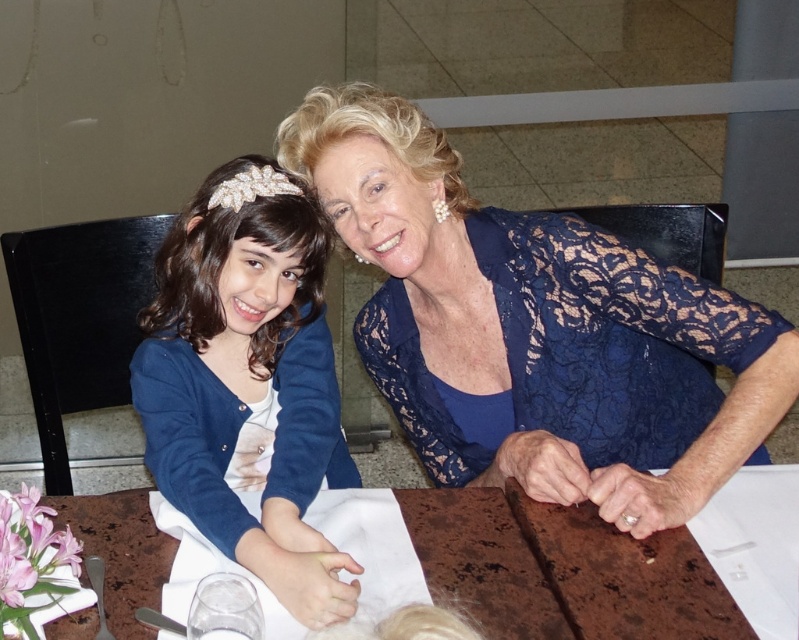
You are standing at the point marked as point [637,410] and want to take a photo of the two people seated at the table. The camera you have can only focus on subjects within 1.5 meters. Will the camera be able to focus on them?

The distance between point [637,410] and the camera is 1.48 meters, which is within the camera focus range of 1.5 meters. Therefore, the camera will be able to focus on them.

You are a photographer taking a portrait of the two people in the image. You need to place a small decorative pin on the matte blue sweater at left. Where should you place it?

The matte blue sweater at left is located at point (247, 380), so you should place the pin there.

You are a fashion designer observing the two individuals. You notice the lace fabric at center and the matte blue sweater at left. Which clothing item is located to the right of the other?

The lace fabric at center is positioned on the right side of the matte blue sweater at left.